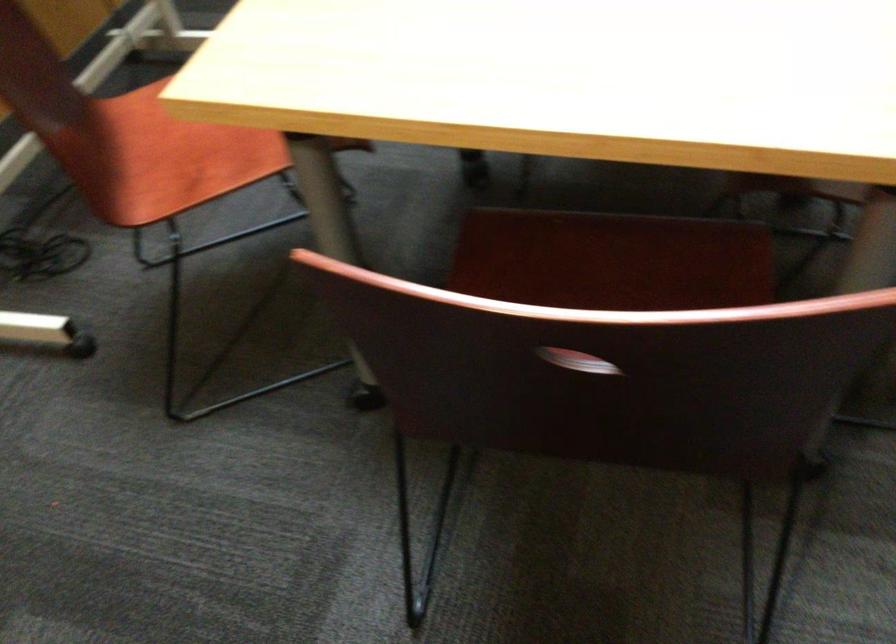
This screenshot has height=644, width=896. Identify the location of dark chair sitting surface. [612, 261].